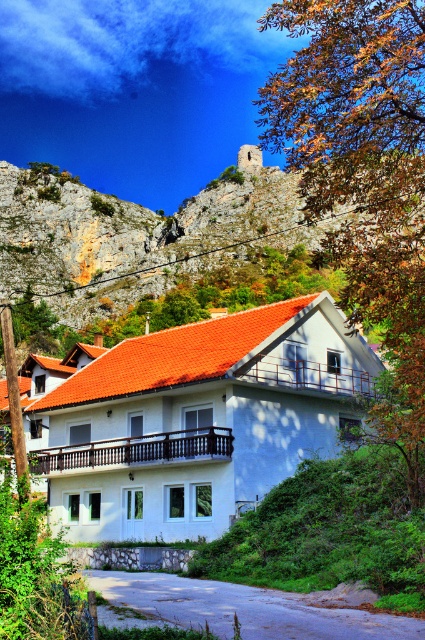
Is brown leafy tree at upper right behind rustic stone wall at upper center?

No.

Can you confirm if brown leafy tree at upper right is positioned to the left of rustic stone wall at upper center?

Incorrect, brown leafy tree at upper right is not on the left side of rustic stone wall at upper center.

Is point (328, 182) positioned behind point (11, 216)?

No, it is in front of (11, 216).

You are a GUI agent. You are given a task and a screenshot of the screen. Output one action in this format:
    pyautogui.click(x=<x>, y=<y>)
    Task: Click on the brown leafy tree at upper right
    Image resolution: width=425 pixels, height=640 pixels.
    Given the screenshot: What is the action you would take?
    363,177